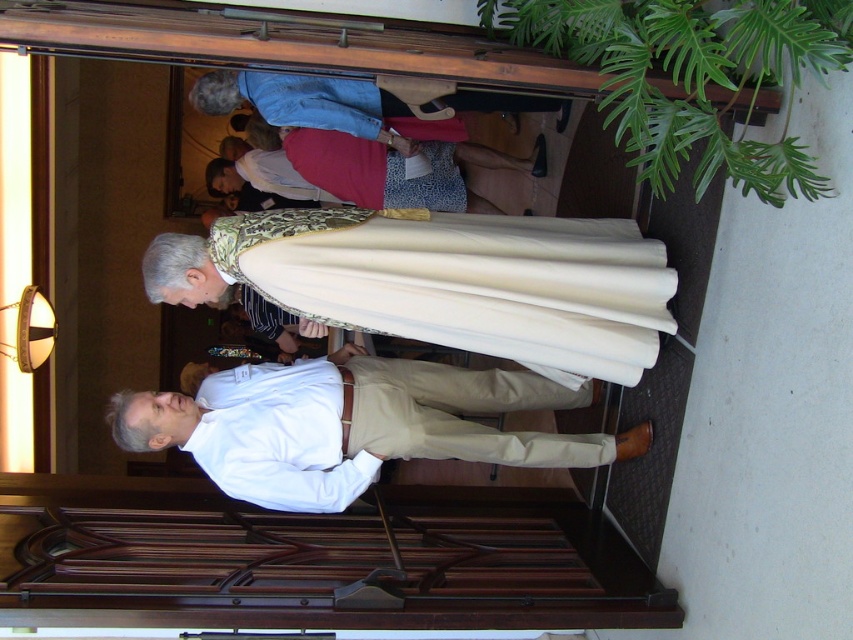
Based on the photo, you are a delivery person with a box that is 1 meter long. You need to pass between the white cotton shirt at center and the matte gold robe at center. Can your box fit through the space between them?

The white cotton shirt at center and the matte gold robe at center are 1.16 meters apart. Since the box is 1 meter long, it can fit through the space between them as the distance is greater than the box length.

You are standing at point (213,449) and want to reach the open wooden door. The door is 3.22 meters away from you. If your walking speed is 1.2 meters per second, how many seconds will it take you to reach the door?

It will take approximately 2.68 seconds to reach the door since distance divided by speed equals time, so 3.22 meters divided by 1.2 meters per second equals approximately 2.68 seconds.